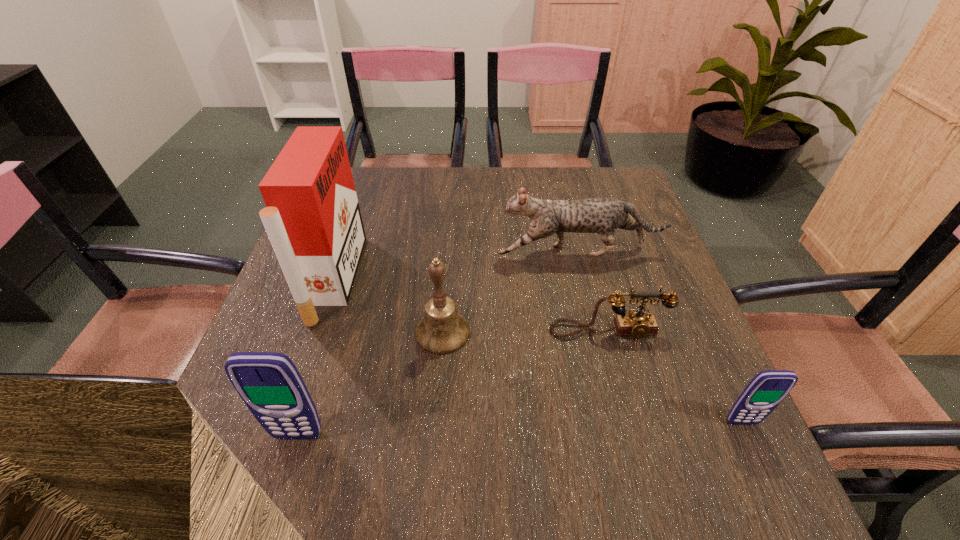
To achieve even spacing by inserting another cellular_telephone among them, please point to a vacant spot for this new cellular_telephone. Please provide its 2D coordinates. Your answer should be formatted as a tuple, i.e. [(x, y)], where the tuple contains the x and y coordinates of a point satisfying the conditions above.

[(522, 429)]